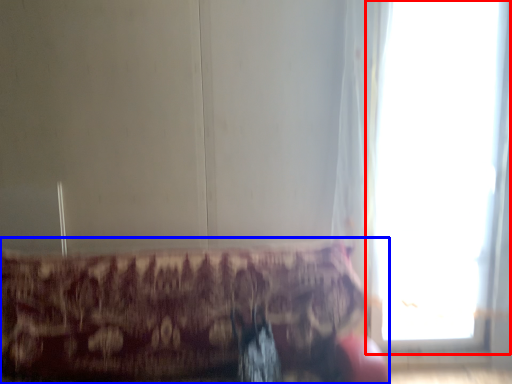
Question: Which of the following is the closest to the observer, window (highlighted by a red box) or furniture (highlighted by a blue box)?

Choices:
 (A) window
 (B) furniture

Answer: (B)